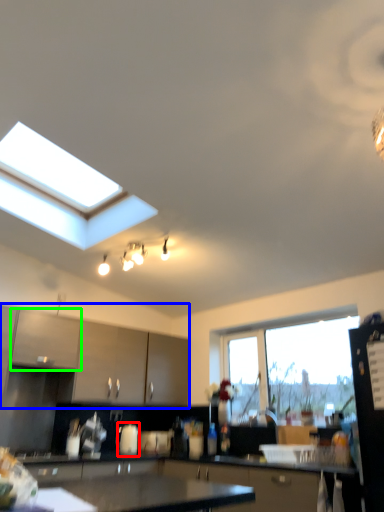
Question: Which is nearer to the appliance (highlighted by a red box)? cabinetry (highlighted by a blue box) or cabinetry (highlighted by a green box).

Choices:
 (A) cabinetry
 (B) cabinetry

Answer: (A)